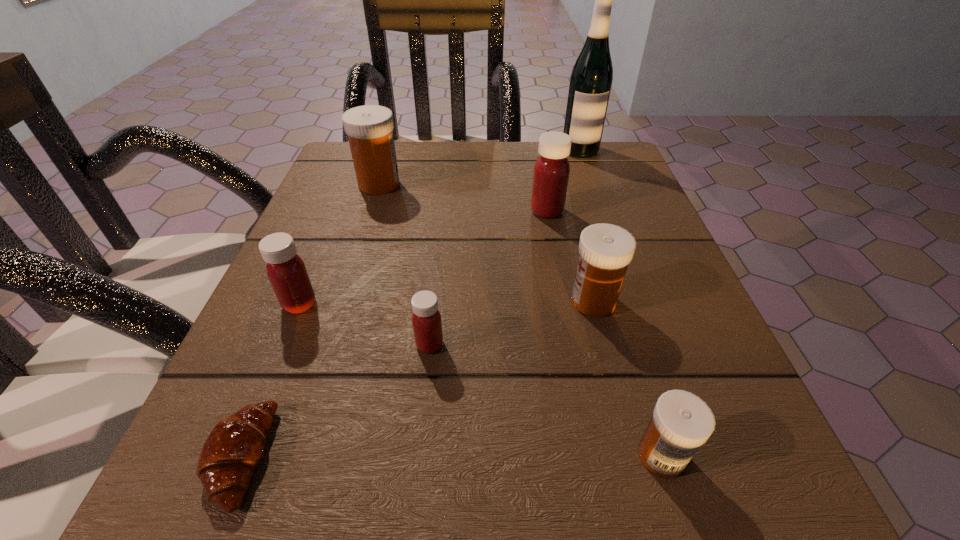
This screenshot has width=960, height=540. I want to click on vacant point located between the second biggest white medicine and the tallest object, so click(x=587, y=226).

Image resolution: width=960 pixels, height=540 pixels. Identify the location of vacant area that lies between the second nearest red medicine and the second red medicine from right to left. (365, 324).

Find the location of a particular element. empty space between the seventh nearest object and the brown crescent roll is located at coordinates (309, 321).

In order to click on blank region between the leftmost red medicine and the smallest red medicine in this screenshot , I will do `click(365, 324)`.

Identify the location of vacant area that lies between the second biggest white medicine and the crescent roll. The image size is (960, 540). (417, 379).

You are a GUI agent. You are given a task and a screenshot of the screen. Output one action in this format:
    pyautogui.click(x=<x>, y=<y>)
    Task: Click on the free spot between the tallest object and the second biggest white medicine
    The height and width of the screenshot is (540, 960).
    Given the screenshot: What is the action you would take?
    pyautogui.click(x=587, y=226)

The width and height of the screenshot is (960, 540). In order to click on free spot between the smallest white medicine and the second farthest medicine in this screenshot , I will do `click(604, 333)`.

I want to click on object that is the second closest to the shortest object, so click(x=427, y=324).

Identify the location of the third closest object to the nearest medicine. (233, 449).

Locate an element on the screen. The height and width of the screenshot is (540, 960). the closest medicine to the second smallest white medicine is located at coordinates (551, 173).